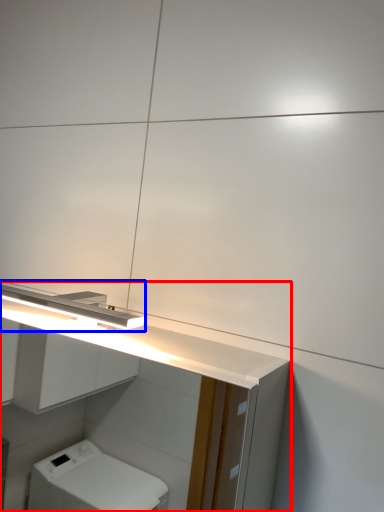
Question: Which object appears farthest to the camera in this image, bathroom cabinet (highlighted by a red box) or light fixture (highlighted by a blue box)?

Choices:
 (A) bathroom cabinet
 (B) light fixture

Answer: (B)